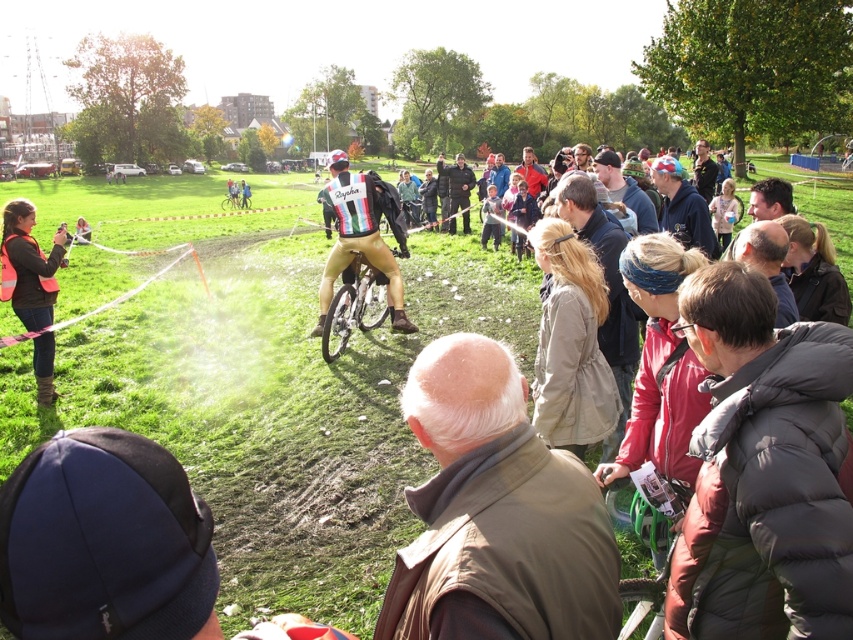
In the scene shown: Can you confirm if reflective orange vest at left is taller than green matte bicycle at center?

Yes.

Is reflective orange vest at left wider than green matte bicycle at center?

Result: Yes, reflective orange vest at left is wider than green matte bicycle at center.

Identify the location of reflective orange vest at left. (27, 266).

Does brown suede vest at center have a greater height compared to green matte bicycle at center?

No.

Looking at this image, does brown suede vest at center appear on the right side of green matte bicycle at center?

No, brown suede vest at center is not to the right of green matte bicycle at center.

At what (x,y) coordinates should I click in order to perform the action: click on brown suede vest at center. Please return your answer as a coordinate pair (x, y). Image resolution: width=853 pixels, height=640 pixels. Looking at the image, I should click on click(x=496, y=513).

Where is `brown suede vest at center`? The width and height of the screenshot is (853, 640). brown suede vest at center is located at coordinates (496, 513).

From the picture: Between brown suede vest at center and shiny gold cycling suit at center, which one is positioned higher?

shiny gold cycling suit at center

Describe the element at coordinates (496, 513) in the screenshot. This screenshot has height=640, width=853. I see `brown suede vest at center` at that location.

Is point (473, 445) positioned in front of point (379, 248)?

Yes, it is in front of point (379, 248).

The image size is (853, 640). Find the location of `brown suede vest at center`. brown suede vest at center is located at coordinates (496, 513).